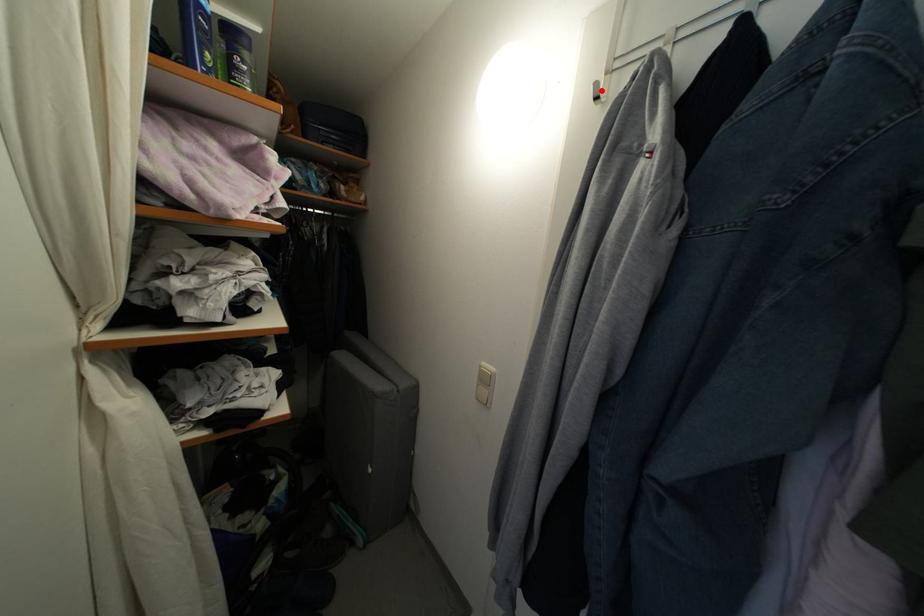
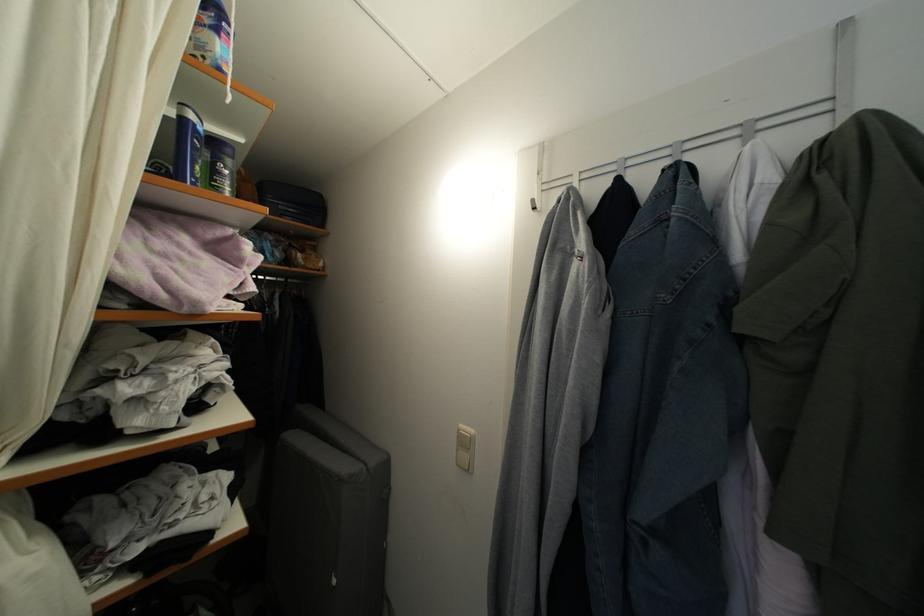
The point at the highlighted location is marked in the first image. Where is the corresponding point in the second image?

(538, 207)